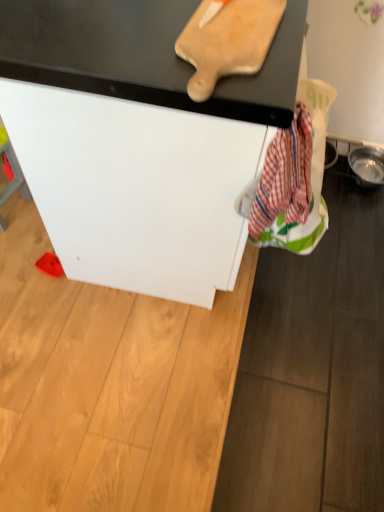
This screenshot has height=512, width=384. In order to click on vacant space in front of white matte cabinet at center in this screenshot , I will do `click(178, 388)`.